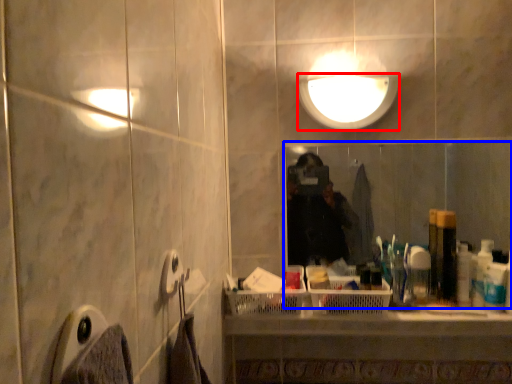
Question: Which object is further to the camera taking this photo, light fixture (highlighted by a red box) or mirror (highlighted by a blue box)?

Choices:
 (A) light fixture
 (B) mirror

Answer: (B)